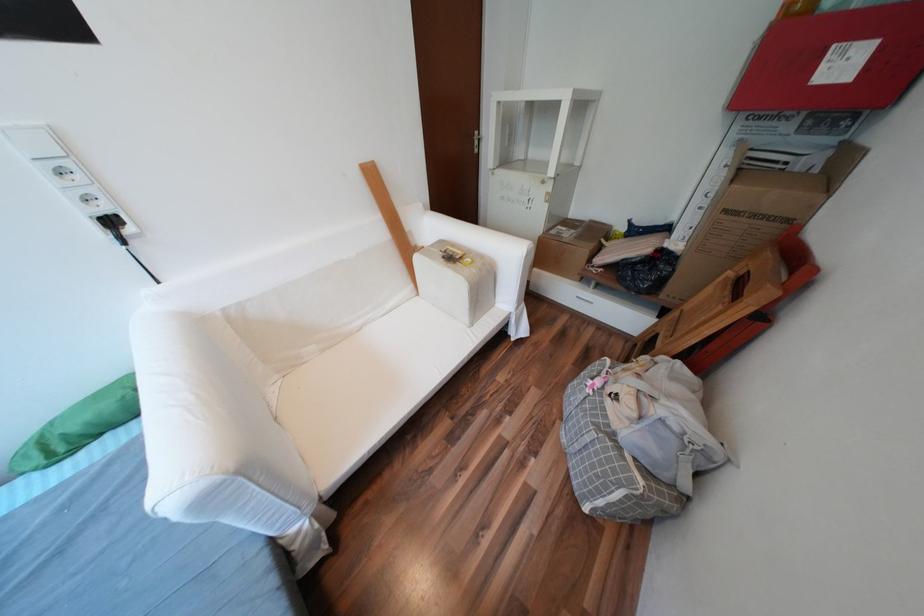
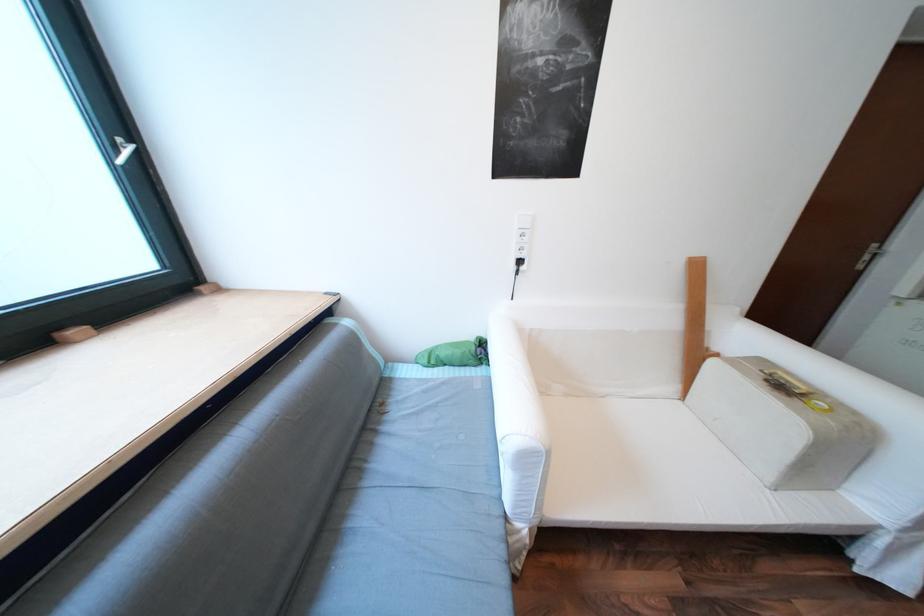
Question: The first image is from the beginning of the video and the second image is from the end. How did the camera likely rotate when shooting the video?

Choices:
 (A) Left
 (B) Right
 (C) Up
 (D) Down

Answer: (A)